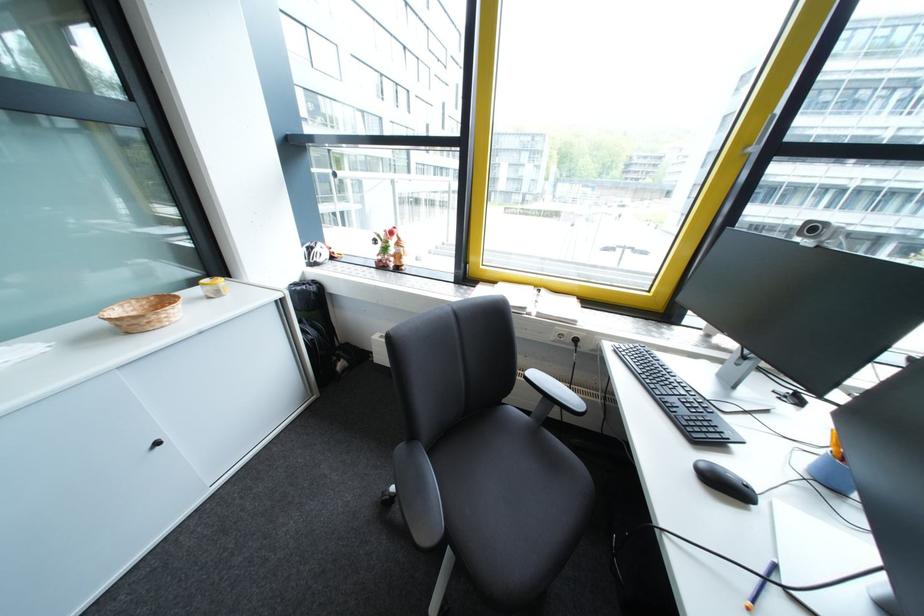
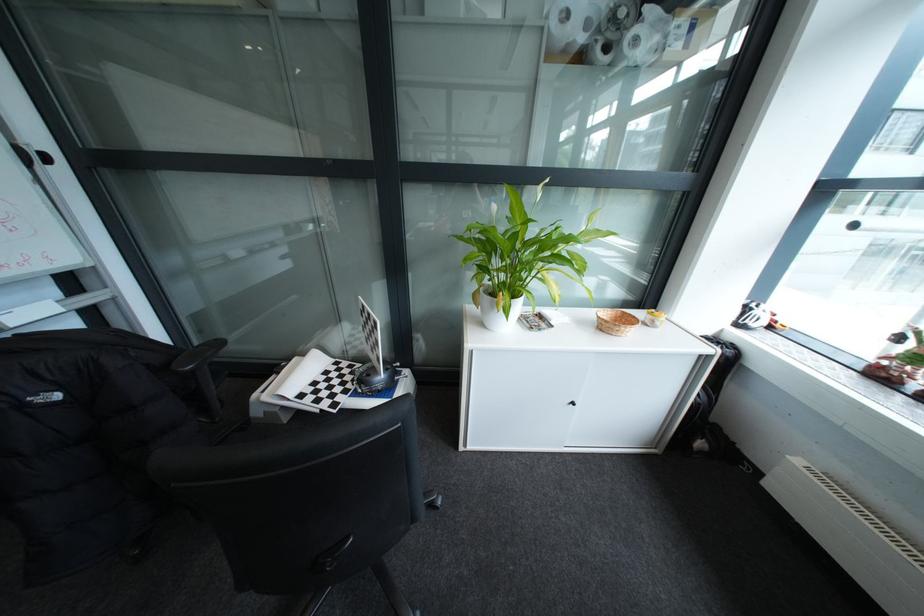
Question: The camera is either moving clockwise (left) or counter-clockwise (right) around the object. The first image is from the beginning of the video and the second image is from the end. Is the camera moving left or right when shooting the video?

Choices:
 (A) Left
 (B) Right

Answer: (B)